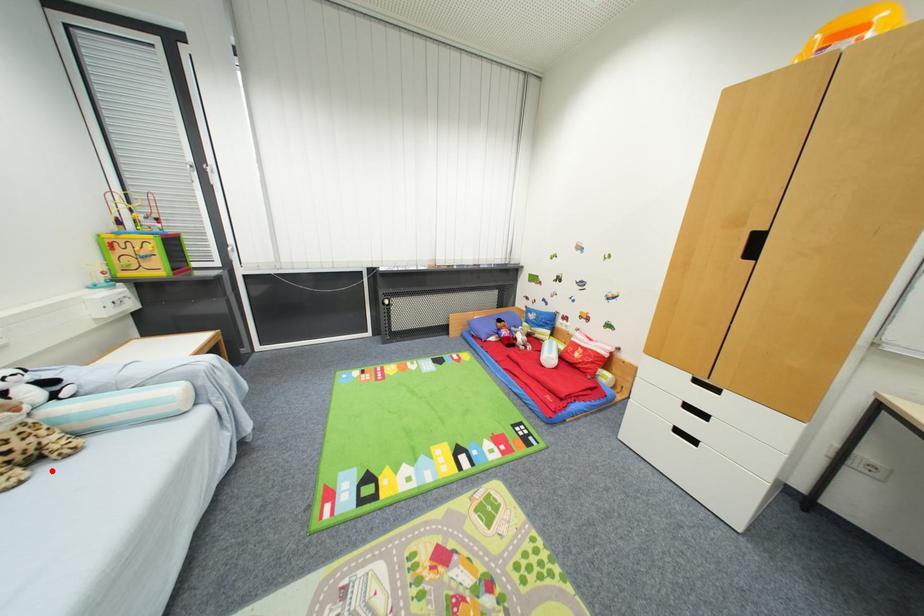
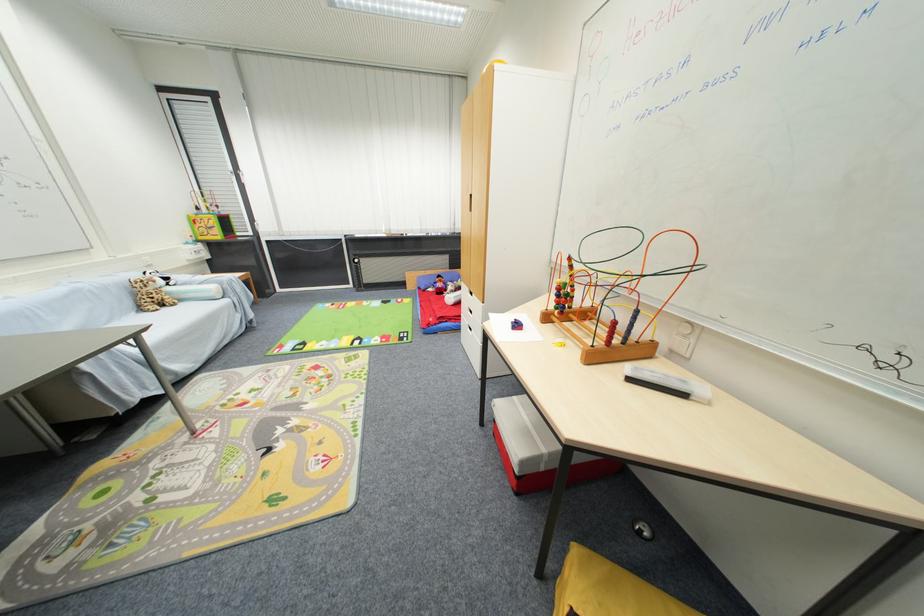
Find the pixel in the second image that matches the highlighted location in the first image.

(171, 310)